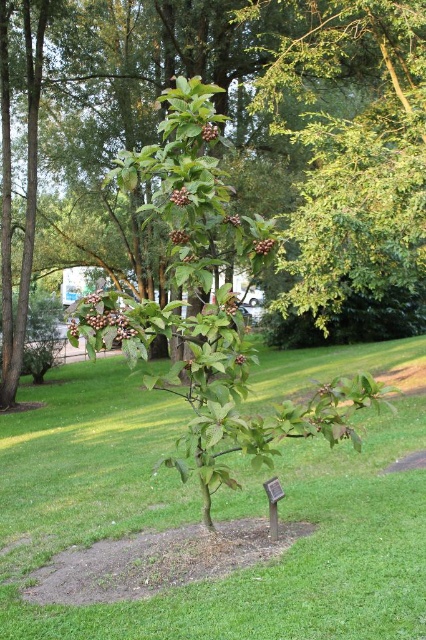
You are standing at a viewpoint in the park and see two points marked in the image. The first point is labeled as point (91, 298) and the second is point (264, 237). Which of these two points is closer to you?

Point (91, 298) is closer to you because it is in front of point (264, 237).